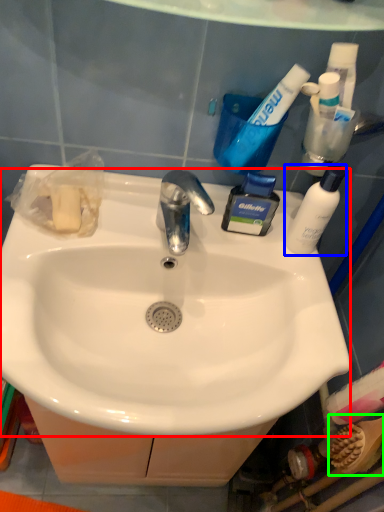
Question: Which object is positioned farthest from sink (highlighted by a red box)? Select from bottle (highlighted by a blue box) and brush (highlighted by a green box).

Choices:
 (A) bottle
 (B) brush

Answer: (B)